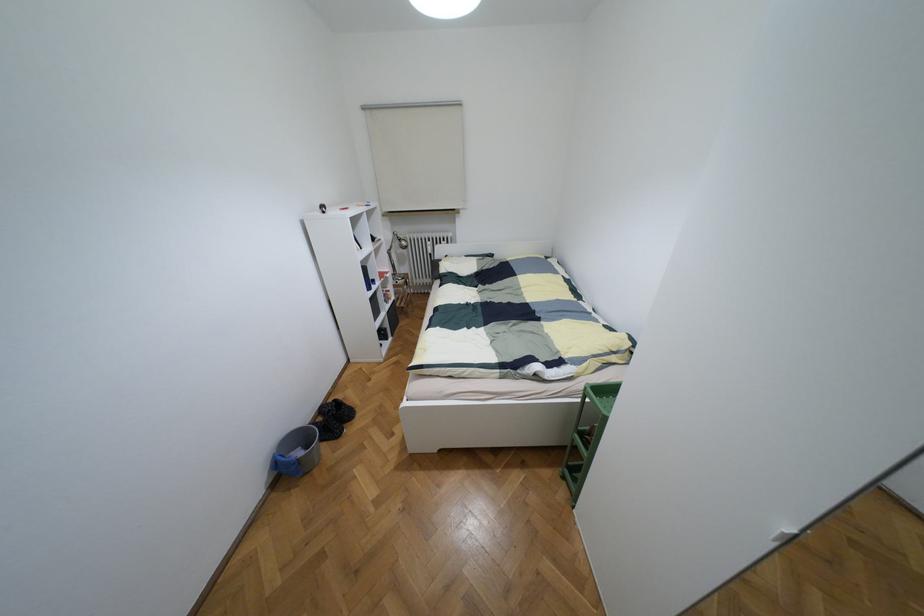
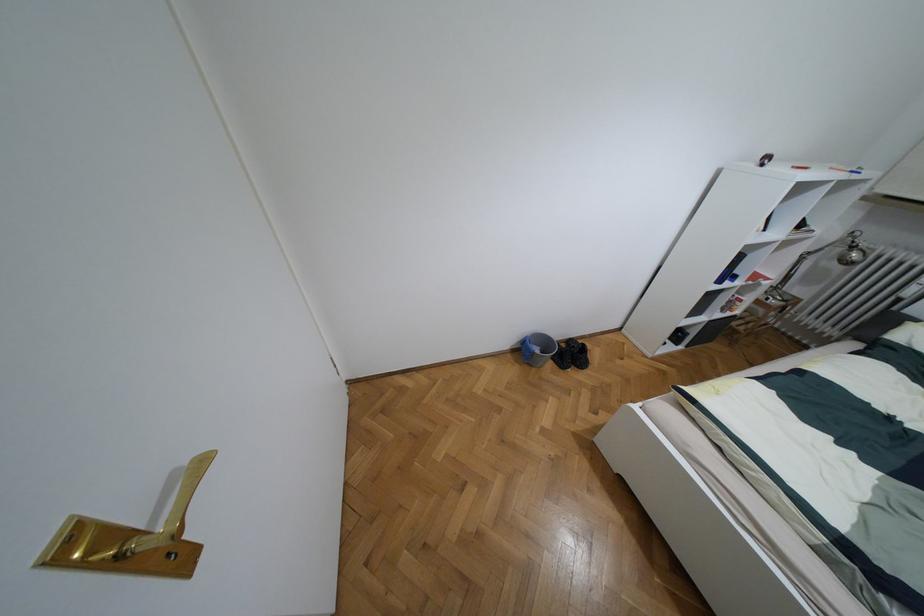
In the second image, find the point that corresponds to point 320,419 in the first image.

(563, 345)